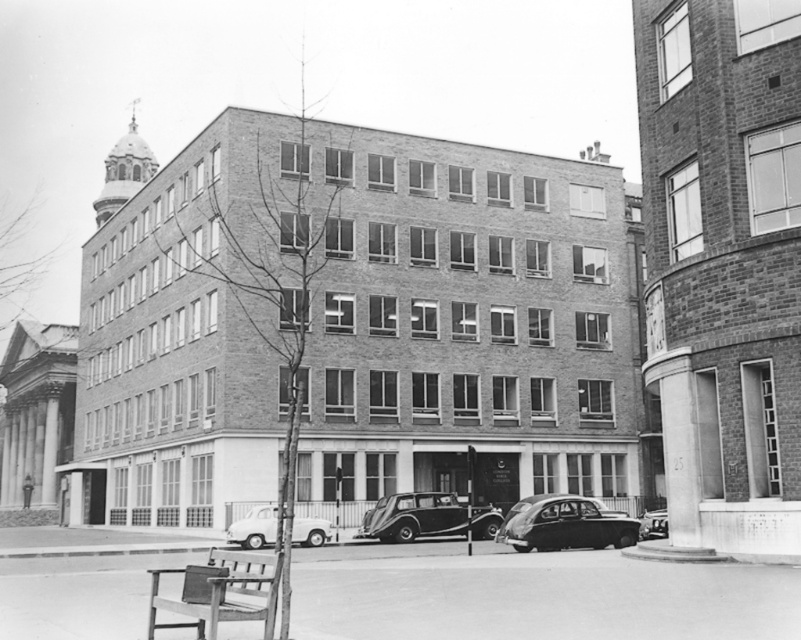
In the scene shown: You are a pedestrian standing at the curb in front of the building. You want to cross the street to reach the park on the other side. The white matte van at lower center and the shiny black car at lower right are blocking your path. Which vehicle should you move around first to get to the park?

The white matte van at lower center is above the shiny black car at lower right, meaning it is closer to you. Therefore, you should move around the white matte van at lower center first before navigating around the shiny black car at lower right.

Consider the image. You are a pedestrian standing on the sidewalk in front of the multi story brick building. You see two cars parked at the center of the image, a shiny black car at center and a shiny silver car at center. Which car is blocking the other one from view?

The shiny black car at center is positioned over the shiny silver car at center, so the shiny black car at center is blocking the shiny silver car at center from view.